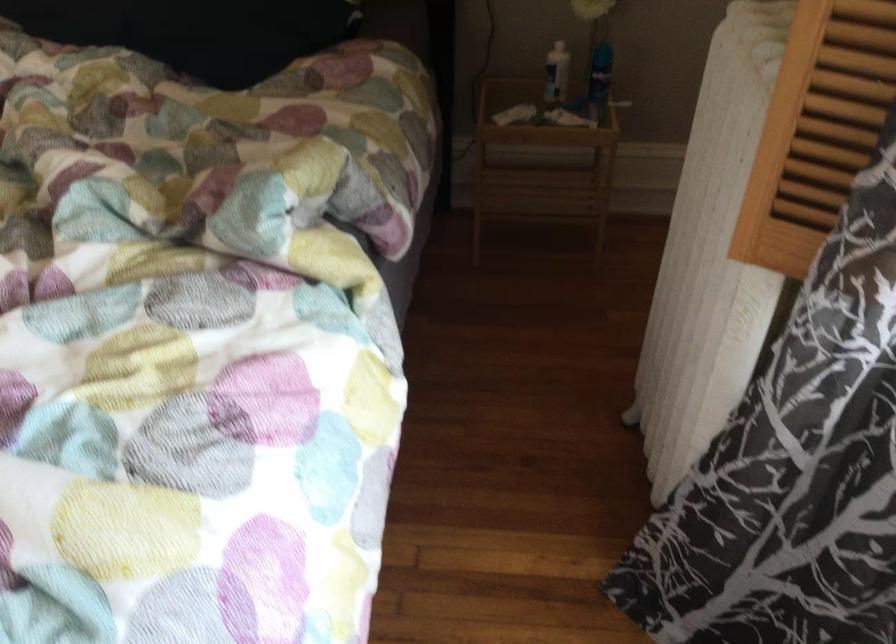
This screenshot has height=644, width=896. In order to click on wooden shutter in this screenshot , I will do `click(815, 129)`.